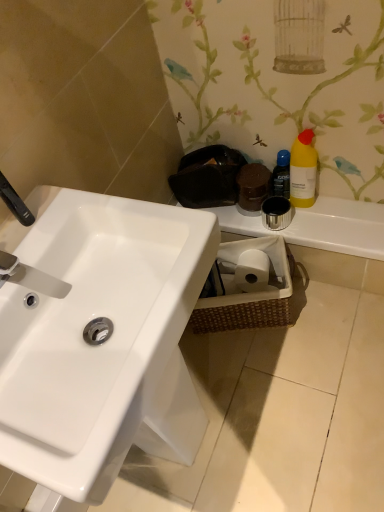
Find the location of a particular element. free space between brushed metal tap at upper left, the first plumbing fixture in the top-to-bottom sequence, and matte silver faucet at left, placed as the 2th plumbing fixture when sorted from top to bottom is located at coordinates (28, 245).